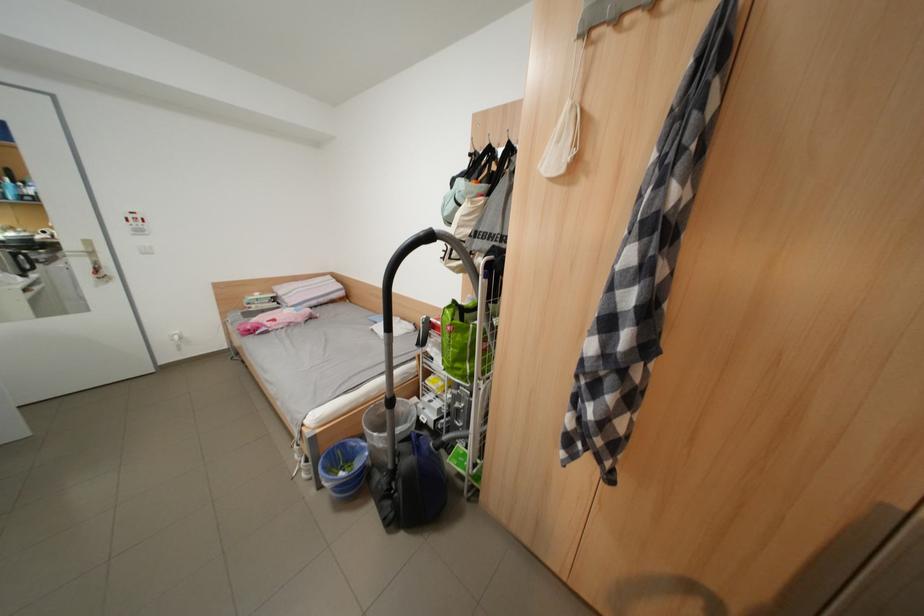
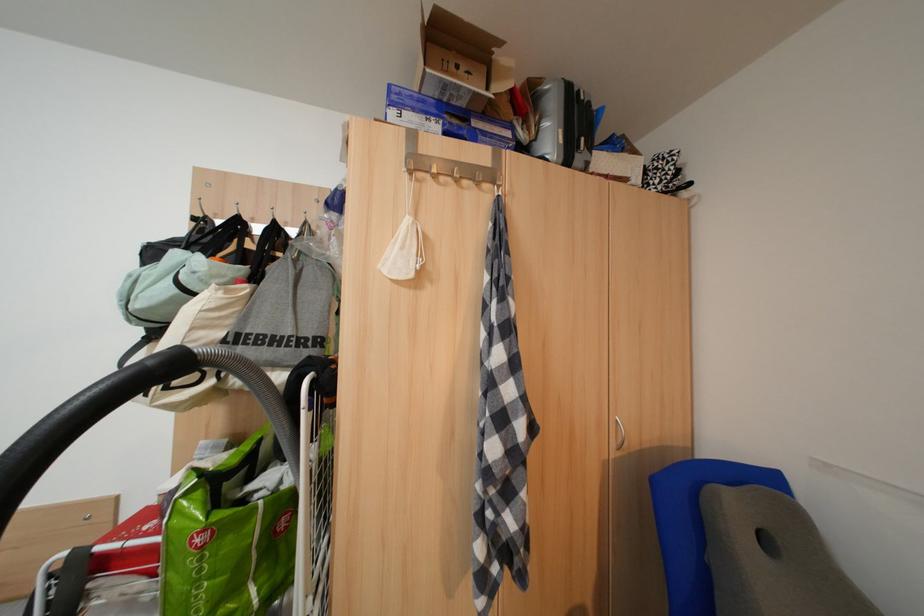
Locate, in the second image, the point that corresponds to pixel 477 214 in the first image.

(224, 307)